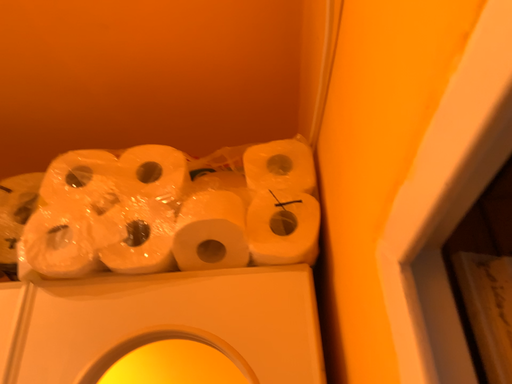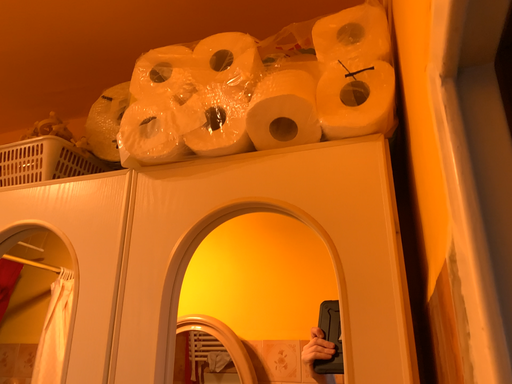
Question: Which way did the camera rotate in the video?

Choices:
 (A) rotated left
 (B) rotated right

Answer: (A)